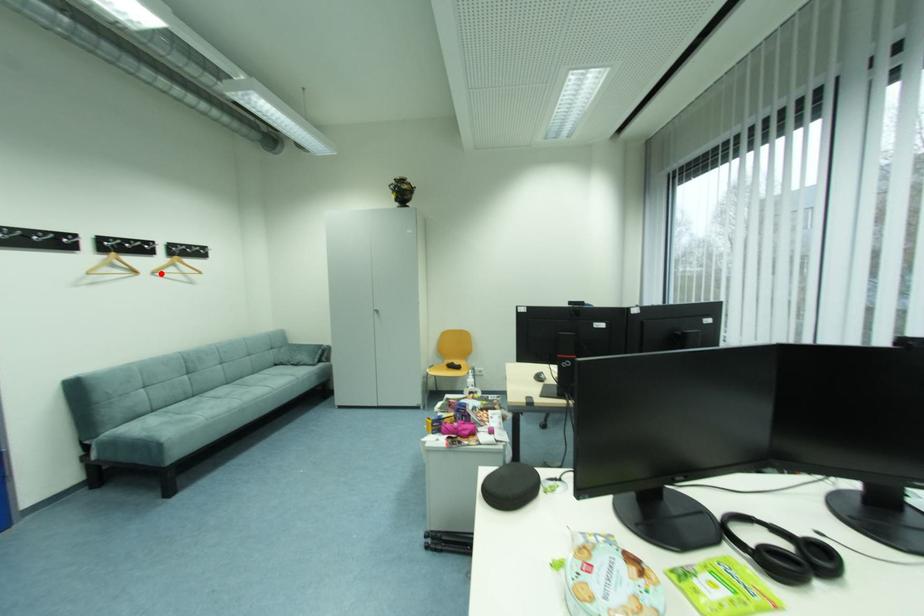
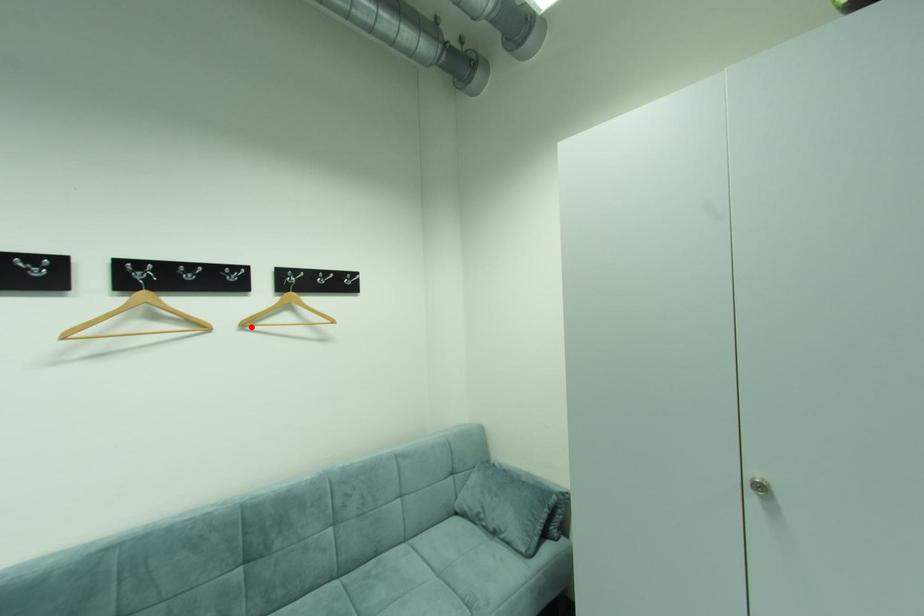
In the scene shown: I am providing you with two images of the same scene from different viewpoints. A red point is marked on the first image and another point is marked on the second image. Are the points marked in image1 and image2 representing the same 3D position?

Yes